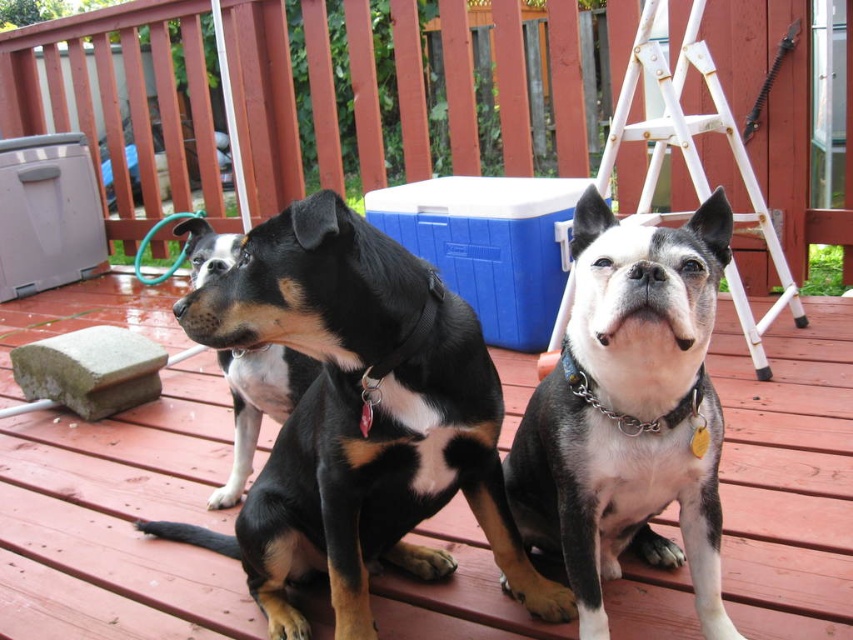
Which of these two, black matte dog at center or blue plastic cooler at center, stands taller?

With more height is black matte dog at center.

Who is positioned more to the right, black matte dog at center or blue plastic cooler at center?

Positioned to the right is blue plastic cooler at center.

Is point (331, 392) farther from viewer compared to point (502, 312)?

No, it is not.

This screenshot has height=640, width=853. In order to click on black matte dog at center in this screenshot , I will do `click(358, 417)`.

Is point (601, 476) more distant than point (659, 157)?

No, it is in front of (659, 157).

Does white/black fur dog at center have a greater width compared to white plastic ladder at upper center?

No.

Between point (647, 436) and point (695, 12), which one is positioned behind?

The point (695, 12) is more distant.

I want to click on white/black fur dog at center, so click(x=630, y=412).

Who is higher up, wooden deck at center or black matte dog at left?

black matte dog at left is above.

Between point (152, 330) and point (236, 497), which one is positioned behind?

The point (152, 330) is more distant.

Between point (556, 630) and point (215, 244), which one is positioned in front?

Point (556, 630) is in front.

Identify the location of wooden deck at center. (120, 518).